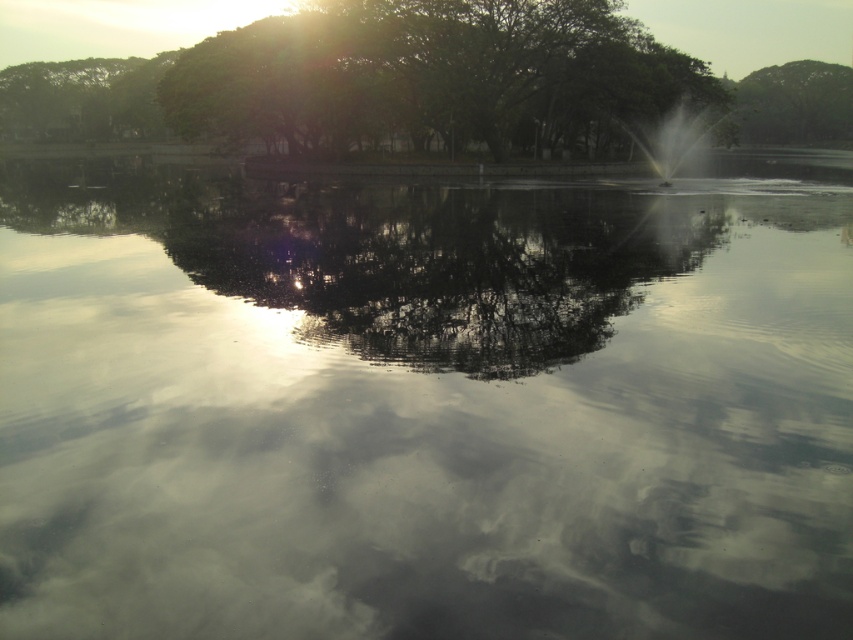
Question: Which point appears closest to the camera in this image?

Choices:
 (A) (350, 26)
 (B) (305, 337)

Answer: (B)

Question: Can you confirm if glossy reflective water at center is positioned to the right of green leafy tree at upper right?

Choices:
 (A) yes
 (B) no

Answer: (B)

Question: Does glossy reflective water at center lie in front of green leafy tree at upper right?

Choices:
 (A) no
 (B) yes

Answer: (B)

Question: Can you confirm if glossy reflective water at center is positioned to the right of green leafy tree at upper right?

Choices:
 (A) yes
 (B) no

Answer: (B)

Question: Based on their relative distances, which object is nearer to the green leafy tree at upper right?

Choices:
 (A) glossy reflective water at center
 (B) green leafy tree at upper center

Answer: (B)

Question: Among these objects, which one is farthest from the camera?

Choices:
 (A) green leafy tree at upper right
 (B) glossy reflective water at center
 (C) green leafy tree at upper center

Answer: (A)